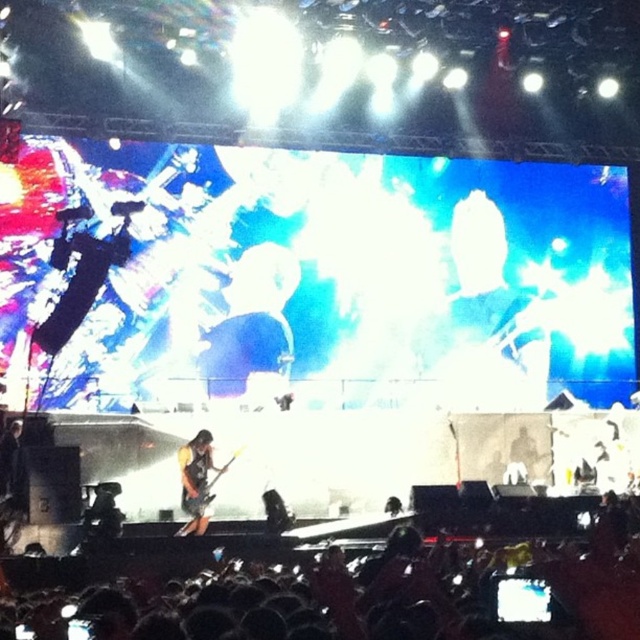
Is black fabric crowd at lower center closer to the viewer compared to orange fabric guitar at center?

Yes, it is.

Can you confirm if black fabric crowd at lower center is taller than orange fabric guitar at center?

In fact, black fabric crowd at lower center may be shorter than orange fabric guitar at center.

Which is in front, point (129, 580) or point (204, 504)?

Point (129, 580) is in front.

Locate an element on the screen. This screenshot has height=640, width=640. black fabric crowd at lower center is located at coordinates (339, 588).